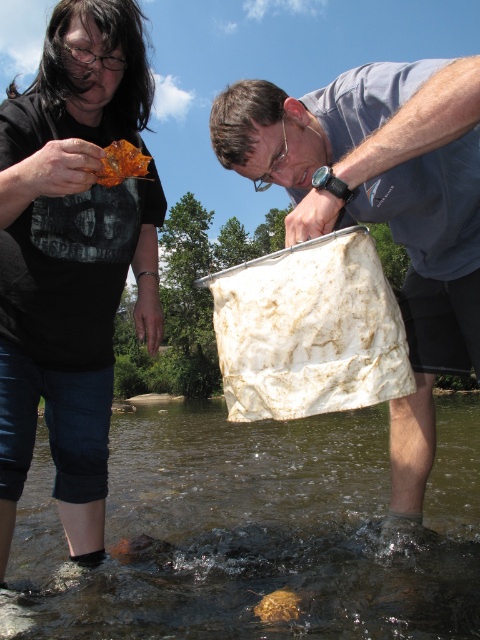
Question: Estimate the real-world distances between objects in this image. Which object is closer to the translucent plastic bag at lower center?

Choices:
 (A) brown matte rock at lower center
 (B) amber glass leaf at upper left

Answer: (B)

Question: Among these points, which one is nearest to the camera?

Choices:
 (A) pos(167,412)
 (B) pos(70,436)
 (C) pos(308,193)
 (D) pos(128,176)

Answer: (C)

Question: Does white textured bucket at center appear over brown matte rock at lower center?

Choices:
 (A) yes
 (B) no

Answer: (A)

Question: Which point is farther to the camera?

Choices:
 (A) (286, 620)
 (B) (117, 170)
 (C) (55, 538)

Answer: (C)

Question: Is translucent plastic bag at lower center positioned at the back of amber glass leaf at upper left?

Choices:
 (A) yes
 (B) no

Answer: (A)

Question: From the image, what is the correct spatial relationship of amber glass leaf at upper left in relation to brown matte rock at lower center?

Choices:
 (A) right
 (B) left

Answer: (B)